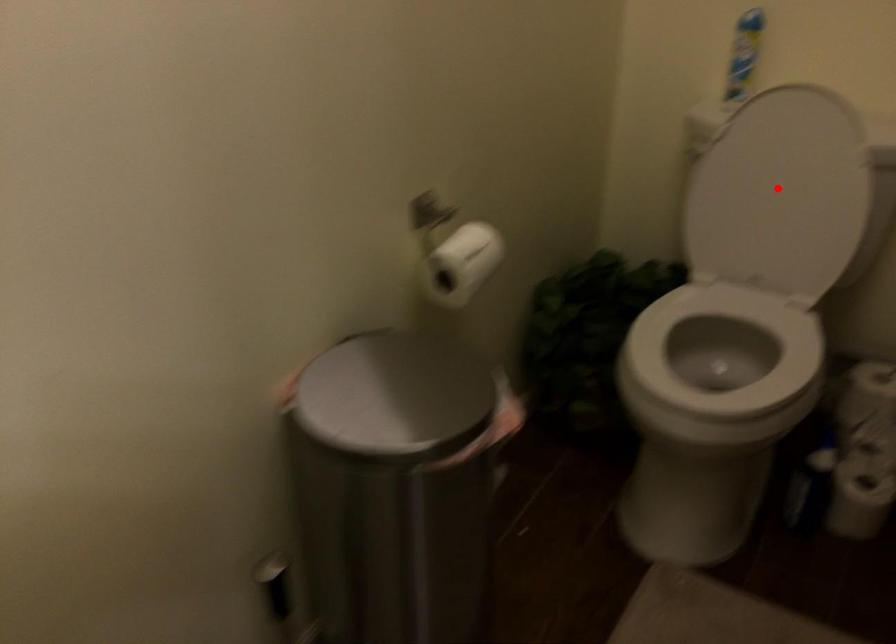
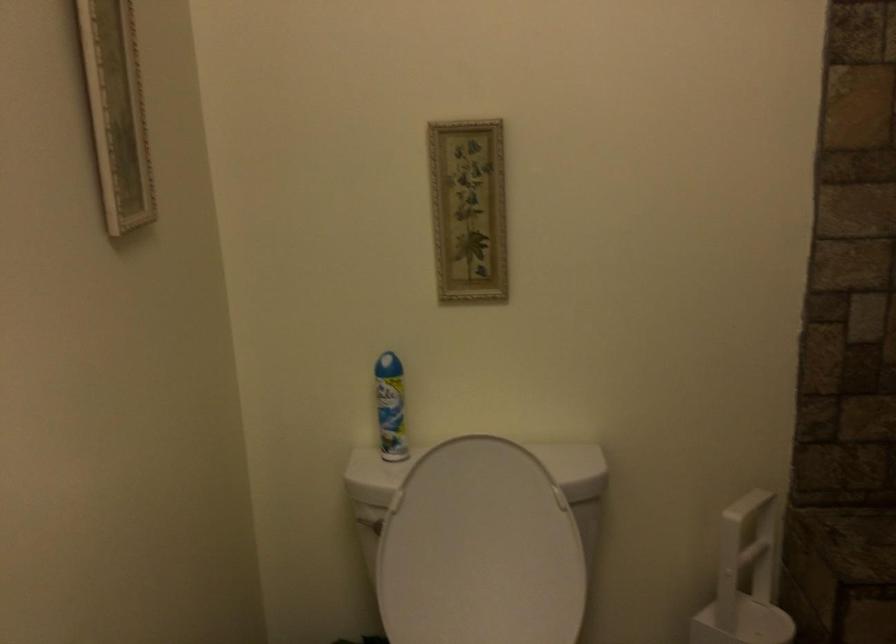
Locate, in the second image, the point that corresponds to the highlighted location in the first image.

(479, 550)